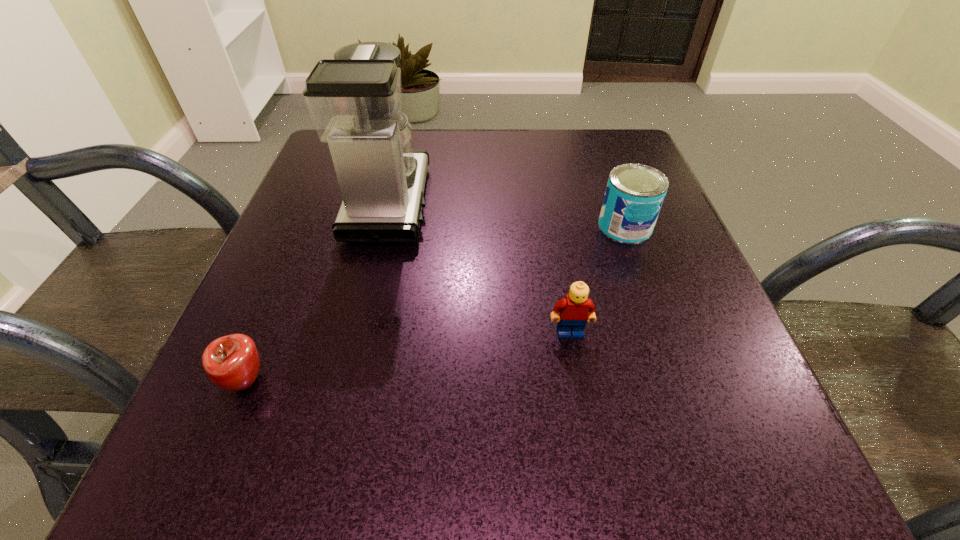
At what (x,y) coordinates should I click in order to perform the action: click on vacant space that's between the can and the second object from right to left. Please return your answer as a coordinate pair (x, y). The height and width of the screenshot is (540, 960). Looking at the image, I should click on (597, 279).

Image resolution: width=960 pixels, height=540 pixels. I want to click on free space between the coffee maker and the leftmost object, so click(318, 292).

Find the location of a particular element. the closest object relative to the rightmost object is located at coordinates (576, 308).

Select which object is the second closest to the third object from left to right. Please provide its 2D coordinates. Your answer should be formatted as a tuple, i.e. [(x, y)], where the tuple contains the x and y coordinates of a point satisfying the conditions above.

[(355, 100)]

Find the location of `free space that satisfies the following two spatial constraints: 1. at the front of the rightmost object where the controls are located; 2. on the left side of the tallest object`. free space that satisfies the following two spatial constraints: 1. at the front of the rightmost object where the controls are located; 2. on the left side of the tallest object is located at coordinates (383, 226).

This screenshot has width=960, height=540. In order to click on free point that satisfies the following two spatial constraints: 1. at the front of the rightmost object where the controls are located; 2. on the right side of the coffee maker in this screenshot , I will do `click(383, 226)`.